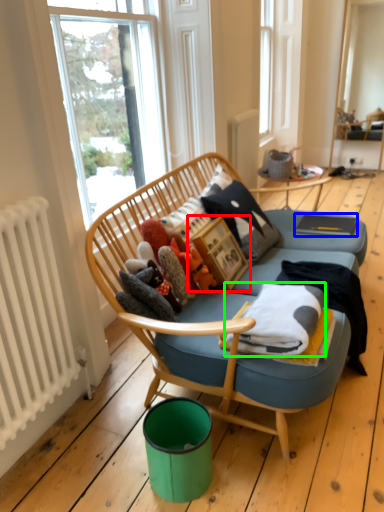
Question: Based on their relative distances, which object is farther from picture frame (highlighted by a red box)? Choose from magazine (highlighted by a blue box) and blanket (highlighted by a green box).

Choices:
 (A) magazine
 (B) blanket

Answer: (A)